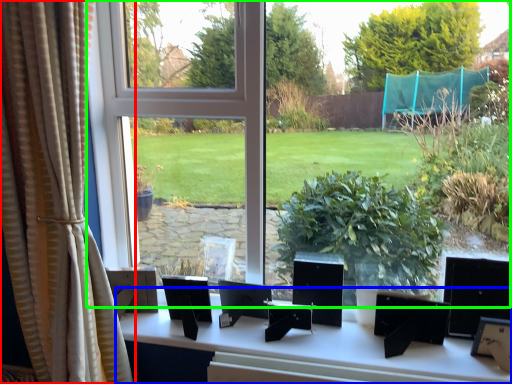
Question: Estimate the real-world distances between objects in this image. Which object is farther from curtain (highlighted by a red box), table (highlighted by a blue box) or window (highlighted by a green box)?

Choices:
 (A) table
 (B) window

Answer: (B)